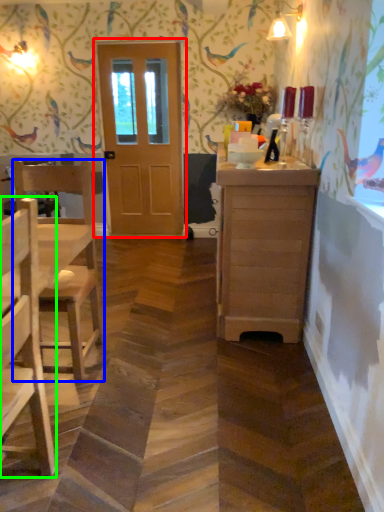
Question: Considering the real-world distances, which object is farthest from door (highlighted by a red box)? chair (highlighted by a blue box) or chair (highlighted by a green box)?

Choices:
 (A) chair
 (B) chair

Answer: (B)